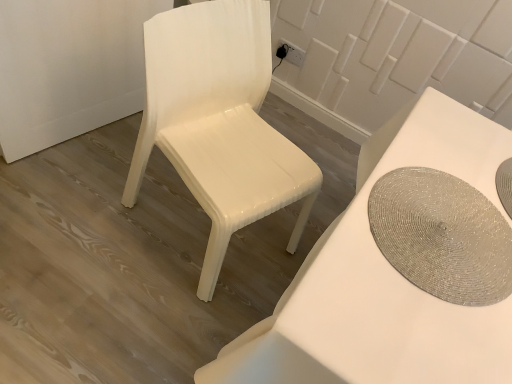
Question: Is the depth of white glossy table at center greater than that of shiny silver placemat at right?

Choices:
 (A) no
 (B) yes

Answer: (A)

Question: Considering the relative sizes of white glossy table at center and shiny silver placemat at right in the image provided, is white glossy table at center taller than shiny silver placemat at right?

Choices:
 (A) yes
 (B) no

Answer: (A)

Question: Is white glossy table at center wider than shiny silver placemat at right?

Choices:
 (A) no
 (B) yes

Answer: (B)

Question: Can you confirm if white glossy table at center is smaller than shiny silver placemat at right?

Choices:
 (A) yes
 (B) no

Answer: (B)

Question: Could you tell me if white glossy table at center is turned towards shiny silver placemat at right?

Choices:
 (A) no
 (B) yes

Answer: (A)

Question: In the image, is shiny silver placemat at right positioned in front of or behind white glossy chair at left?

Choices:
 (A) behind
 (B) front

Answer: (B)

Question: Is shiny silver placemat at right taller or shorter than white glossy chair at left?

Choices:
 (A) tall
 (B) short

Answer: (B)

Question: Is shiny silver placemat at right situated inside white glossy chair at left or outside?

Choices:
 (A) outside
 (B) inside

Answer: (A)

Question: Based on their sizes in the image, would you say shiny silver placemat at right is bigger or smaller than white glossy chair at left?

Choices:
 (A) small
 (B) big

Answer: (A)

Question: From a real-world perspective, is white glossy chair at left above or below shiny silver placemat at right?

Choices:
 (A) below
 (B) above

Answer: (A)

Question: Considering the relative positions of white glossy chair at left and shiny silver placemat at right in the image provided, is white glossy chair at left to the left or to the right of shiny silver placemat at right?

Choices:
 (A) right
 (B) left

Answer: (B)

Question: Relative to shiny silver placemat at right, is white glossy chair at left in front or behind?

Choices:
 (A) front
 (B) behind

Answer: (B)

Question: Is point (262, 162) positioned closer to the camera than point (439, 233)?

Choices:
 (A) closer
 (B) farther

Answer: (B)

Question: Is white glossy chair at left inside or outside of white glossy table at center?

Choices:
 (A) inside
 (B) outside

Answer: (B)

Question: Considering their positions, is white glossy chair at left located in front of or behind white glossy table at center?

Choices:
 (A) front
 (B) behind

Answer: (B)